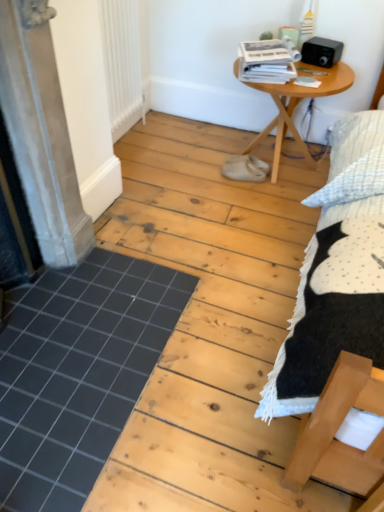
Question: Could you tell me if black tile at lower left is turned towards matte gray screen door at left?

Choices:
 (A) yes
 (B) no

Answer: (B)

Question: Is black tile at lower left behind matte gray screen door at left?

Choices:
 (A) yes
 (B) no

Answer: (A)

Question: From the image's perspective, is black tile at lower left located beneath matte gray screen door at left?

Choices:
 (A) no
 (B) yes

Answer: (B)

Question: Does black tile at lower left have a greater width compared to matte gray screen door at left?

Choices:
 (A) yes
 (B) no

Answer: (A)

Question: Could matte gray screen door at left be considered to be inside black tile at lower left?

Choices:
 (A) no
 (B) yes

Answer: (A)

Question: Is white matte radiator at upper left inside the boundaries of wooden table at center, or outside?

Choices:
 (A) inside
 (B) outside

Answer: (B)

Question: From a real-world perspective, is white matte radiator at upper left positioned above or below wooden table at center?

Choices:
 (A) below
 (B) above

Answer: (B)

Question: Based on their positions, is white matte radiator at upper left located to the left or right of wooden table at center?

Choices:
 (A) left
 (B) right

Answer: (A)

Question: From their relative heights in the image, would you say white matte radiator at upper left is taller or shorter than wooden table at center?

Choices:
 (A) tall
 (B) short

Answer: (A)

Question: Considering their positions, is matte gray screen door at left located in front of or behind black tile at lower left?

Choices:
 (A) front
 (B) behind

Answer: (A)

Question: Looking at the image, does matte gray screen door at left seem bigger or smaller compared to black tile at lower left?

Choices:
 (A) small
 (B) big

Answer: (B)

Question: From a real-world perspective, relative to black tile at lower left, is matte gray screen door at left vertically above or below?

Choices:
 (A) above
 (B) below

Answer: (A)

Question: Is point (36, 173) closer or farther from the camera than point (59, 287)?

Choices:
 (A) closer
 (B) farther

Answer: (A)

Question: Would you say matte gray screen door at left is to the left or to the right of wooden table at center in the picture?

Choices:
 (A) left
 (B) right

Answer: (A)

Question: From a real-world perspective, is matte gray screen door at left physically located above or below wooden table at center?

Choices:
 (A) above
 (B) below

Answer: (A)